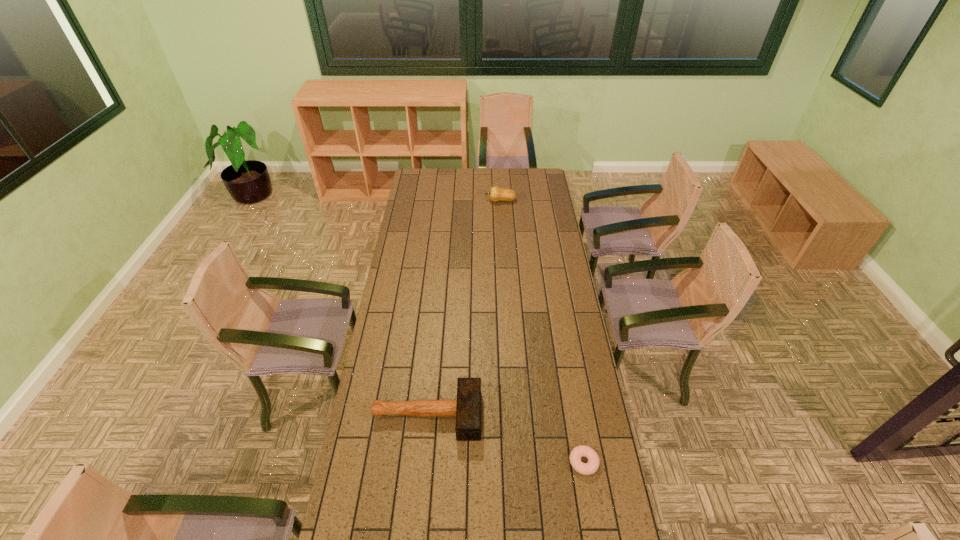
The height and width of the screenshot is (540, 960). Identify the location of vacant region between the leftmost object and the shortest object. (505, 438).

The width and height of the screenshot is (960, 540). In order to click on vacant space that is in between the second object from right to left and the doughnut in this screenshot , I will do `click(541, 332)`.

Where is `unoccupied area between the nearest object and the mallet`? The width and height of the screenshot is (960, 540). unoccupied area between the nearest object and the mallet is located at coordinates (505, 438).

The height and width of the screenshot is (540, 960). Identify the location of vacant area between the second nearest object and the rightmost object. (505, 438).

Identify the location of blank region between the rightmost object and the second object from left to right. (541, 332).

The height and width of the screenshot is (540, 960). Find the location of `free space between the doughnut and the gourd`. free space between the doughnut and the gourd is located at coordinates (541, 332).

Where is `blank region between the second object from left to right and the doughnut`? Image resolution: width=960 pixels, height=540 pixels. blank region between the second object from left to right and the doughnut is located at coordinates (541, 332).

At what (x,y) coordinates should I click in order to perform the action: click on object that is the closest one to the second nearest object. Please return your answer as a coordinate pair (x, y). Looking at the image, I should click on (591, 467).

Locate which object ranks second in proximity to the mallet. Please provide its 2D coordinates. Your answer should be formatted as a tuple, i.e. [(x, y)], where the tuple contains the x and y coordinates of a point satisfying the conditions above.

[(496, 193)]

The image size is (960, 540). Find the location of `free space that satisfies the following two spatial constraints: 1. on the back side of the nearest object; 2. on the stem side of the farthest object`. free space that satisfies the following two spatial constraints: 1. on the back side of the nearest object; 2. on the stem side of the farthest object is located at coordinates (540, 201).